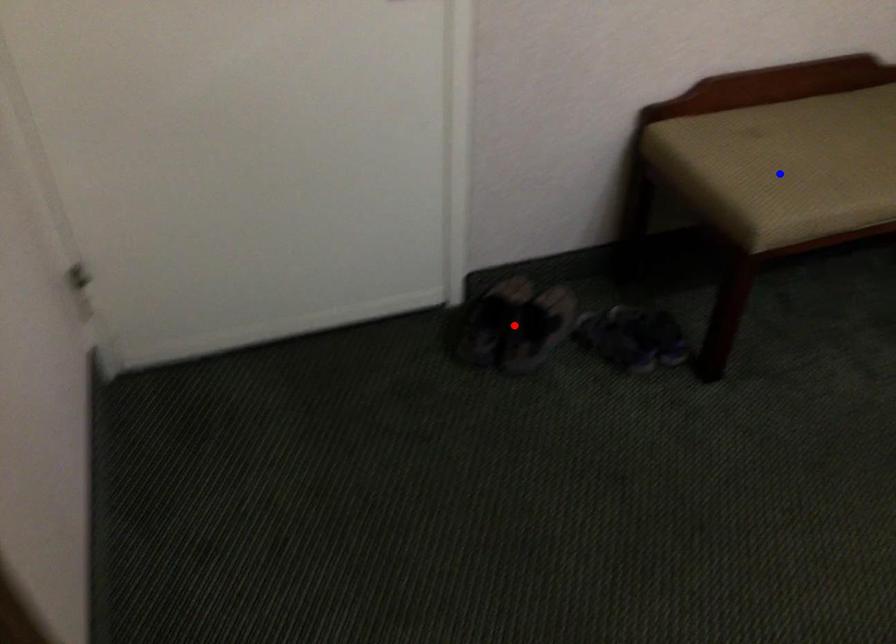
Question: In the image, two points are highlighted. Which point is nearer to the camera? Reply with the corresponding letter.

Choices:
 (A) blue point
 (B) red point

Answer: (A)